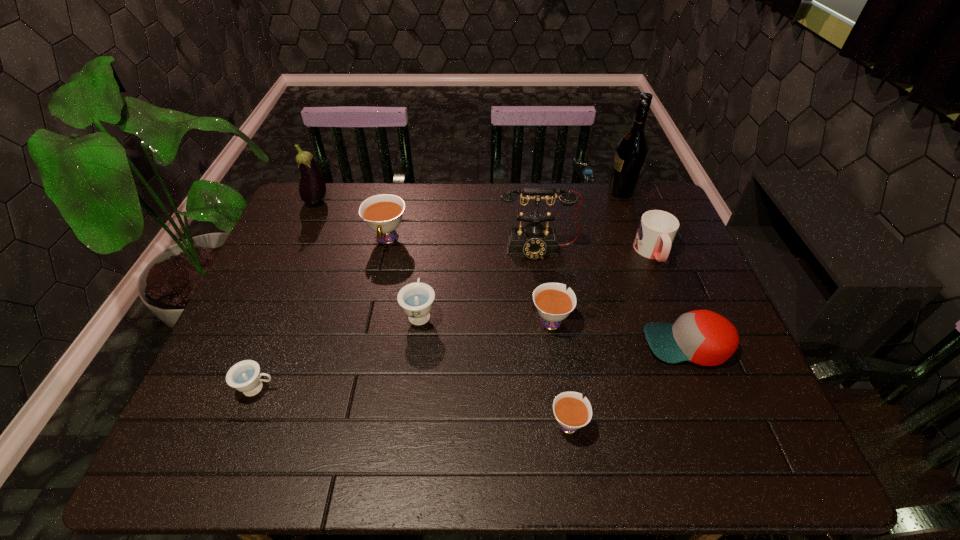
Identify the location of free space between the eggplant and the smaller blue teacup. The height and width of the screenshot is (540, 960). (287, 295).

The height and width of the screenshot is (540, 960). I want to click on free space between the right blue teacup and the black telephone, so click(x=479, y=281).

Locate an element on the screen. The image size is (960, 540). object that is the fifth closest to the telephone is located at coordinates (703, 337).

Locate an element on the screen. object that is the ninth nearest to the mug is located at coordinates (244, 376).

At what (x,y) coordinates should I click in order to perform the action: click on the fifth closest teacup to the tallest object. Please return your answer as a coordinate pair (x, y). The width and height of the screenshot is (960, 540). Looking at the image, I should click on click(x=244, y=376).

You are a GUI agent. You are given a task and a screenshot of the screen. Output one action in this format:
    pyautogui.click(x=<x>, y=<y>)
    Task: Click on the teacup identified as the fifth closest to the telephone
    This screenshot has height=540, width=960.
    Given the screenshot: What is the action you would take?
    244,376

Identify which white teacup is the nearest to the eggplant. Please provide its 2D coordinates. Your answer should be formatted as a tuple, i.e. [(x, y)], where the tuple contains the x and y coordinates of a point satisfying the conditions above.

[(382, 213)]

Select which white teacup is the closest to the red baseball cap. Please provide its 2D coordinates. Your answer should be formatted as a tuple, i.e. [(x, y)], where the tuple contains the x and y coordinates of a point satisfying the conditions above.

[(553, 303)]

This screenshot has height=540, width=960. In order to click on vacant space that satisfies the following two spatial constraints: 1. on the side of the mug with the handle; 2. on the side of the fourth farthest teacup with the handle in this screenshot , I will do `click(707, 388)`.

You are a GUI agent. You are given a task and a screenshot of the screen. Output one action in this format:
    pyautogui.click(x=<x>, y=<y>)
    Task: Click on the free space that satisfies the following two spatial constraints: 1. on the label of the tallest object; 2. on the dial of the black telephone
    The height and width of the screenshot is (540, 960).
    Given the screenshot: What is the action you would take?
    pyautogui.click(x=642, y=249)